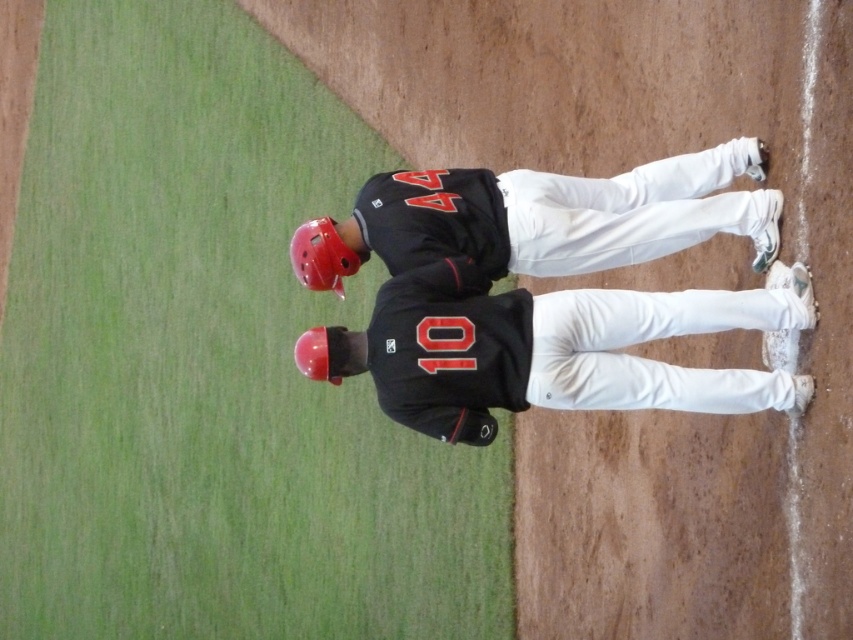
Which of these two, black matte jersey at center or rubber matte baseball glove at center, stands taller?

black matte jersey at center

From the picture: Is black matte jersey at center wider than rubber matte baseball glove at center?

Yes, black matte jersey at center is wider than rubber matte baseball glove at center.

Where is `black matte jersey at center`? black matte jersey at center is located at coordinates (579, 298).

This screenshot has height=640, width=853. In order to click on black matte jersey at center in this screenshot , I will do `click(579, 298)`.